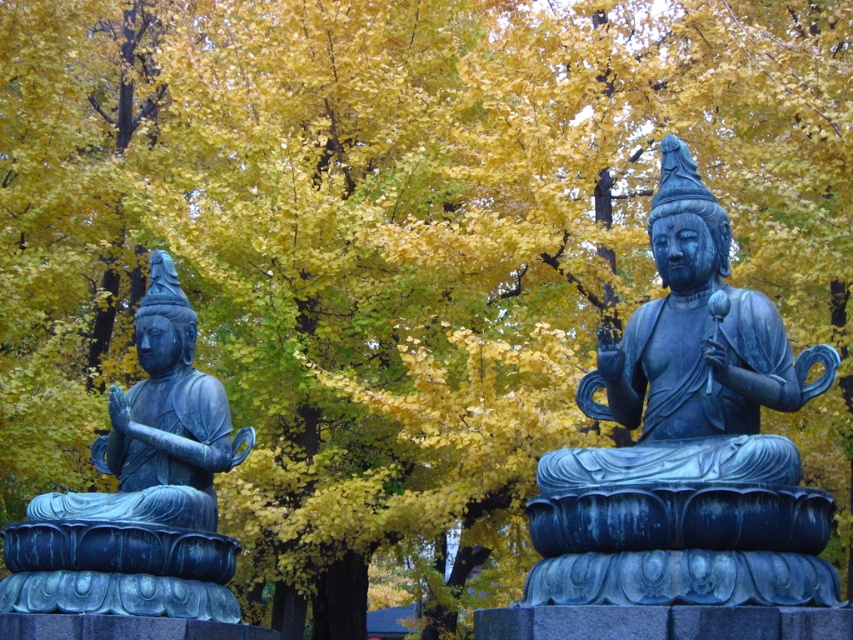
You are standing at a point 37.45 meters away from the point marked as point (572, 486) in the image. You want to take a photo of the statues of seated figures. Will you be able to capture both statues in a single frame if your camera has a standard 50mm lens?

The distance between you and point (572, 486) is 37.45 meters. A standard 50mm lens has a field of view wide enough to capture objects at that distance within a single frame, so yes, both statues should be visible in the photo.

You are an archaeologist examining the image of two statues. You notice a specific point at coordinates (688, 442). Which statue is located at this point, the bronze statue at right or the other one?

The bronze statue at right is located at point (688, 442).